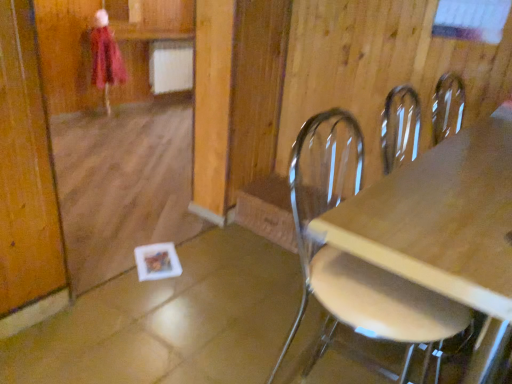
Locate an element on the screen. The image size is (512, 384). matte pink coat at upper left is located at coordinates (105, 57).

The height and width of the screenshot is (384, 512). What do you see at coordinates (105, 57) in the screenshot?
I see `matte pink coat at upper left` at bounding box center [105, 57].

What do you see at coordinates (355, 256) in the screenshot? The image size is (512, 384). I see `metallic silver chair at right` at bounding box center [355, 256].

You are a GUI agent. You are given a task and a screenshot of the screen. Output one action in this format:
    pyautogui.click(x=<x>, y=<y>)
    Task: Click on the metallic silver chair at right
    The height and width of the screenshot is (384, 512).
    Given the screenshot: What is the action you would take?
    pyautogui.click(x=355, y=256)

This screenshot has height=384, width=512. In order to click on matte pink coat at upper left in this screenshot , I will do `click(105, 57)`.

Can you confirm if metallic silver chair at right is positioned to the right of matte pink coat at upper left?

Indeed, metallic silver chair at right is positioned on the right side of matte pink coat at upper left.

Relative to matte pink coat at upper left, is metallic silver chair at right in front or behind?

metallic silver chair at right is in front of matte pink coat at upper left.

Considering the positions of point (302, 143) and point (117, 61), is point (302, 143) closer or farther from the camera than point (117, 61)?

Point (302, 143) appears to be closer to the viewer than point (117, 61).

From the image's perspective, is metallic silver chair at right under matte pink coat at upper left?

Correct, metallic silver chair at right appears lower than matte pink coat at upper left in the image.

From a real-world perspective, is metallic silver chair at right located higher than matte pink coat at upper left?

Yes, from a real-world perspective, metallic silver chair at right is above matte pink coat at upper left.

Considering the sizes of objects metallic silver chair at right and matte pink coat at upper left in the image provided, who is thinner, metallic silver chair at right or matte pink coat at upper left?

matte pink coat at upper left is thinner.

Does metallic silver chair at right have a greater height compared to matte pink coat at upper left?

Indeed, metallic silver chair at right has a greater height compared to matte pink coat at upper left.

Based on their sizes in the image, would you say metallic silver chair at right is bigger or smaller than matte pink coat at upper left?

Clearly, metallic silver chair at right is larger in size than matte pink coat at upper left.

Would you say matte pink coat at upper left is part of metallic silver chair at right's contents?

No, matte pink coat at upper left is not a part of metallic silver chair at right.

Is metallic silver chair at right next to matte pink coat at upper left?

They are not placed beside each other.

Is metallic silver chair at right facing towards matte pink coat at upper left?

No, metallic silver chair at right is not aimed at matte pink coat at upper left.

What's the angular difference between metallic silver chair at right and matte pink coat at upper left's facing directions?

The angle between the facing direction of metallic silver chair at right and the facing direction of matte pink coat at upper left is 90.2 degrees.

Image resolution: width=512 pixels, height=384 pixels. I want to click on person below the metallic silver chair at right (from a real-world perspective), so click(x=105, y=57).

Based on their positions, is matte pink coat at upper left located to the left or right of metallic silver chair at right?

Clearly, matte pink coat at upper left is on the left of metallic silver chair at right in the image.

Considering their positions, is matte pink coat at upper left located in front of or behind metallic silver chair at right?

Visually, matte pink coat at upper left is located behind metallic silver chair at right.

Which is more distant, [111,46] or [303,211]?

The point [111,46] is farther.

From the image's perspective, which one is positioned higher, matte pink coat at upper left or metallic silver chair at right?

matte pink coat at upper left is shown above in the image.

From a real-world perspective, is matte pink coat at upper left located higher than metallic silver chair at right?

Actually, matte pink coat at upper left is physically below metallic silver chair at right in the real world.

Does matte pink coat at upper left have a greater width compared to metallic silver chair at right?

No, matte pink coat at upper left is not wider than metallic silver chair at right.

From their relative heights in the image, would you say matte pink coat at upper left is taller or shorter than metallic silver chair at right?

matte pink coat at upper left is shorter than metallic silver chair at right.

Looking at the image, does matte pink coat at upper left seem bigger or smaller compared to metallic silver chair at right?

matte pink coat at upper left is smaller than metallic silver chair at right.

Consider the image. Is metallic silver chair at right a part of matte pink coat at upper left?

No, metallic silver chair at right is not surrounded by matte pink coat at upper left.

Is matte pink coat at upper left with metallic silver chair at right?

No, matte pink coat at upper left is not next to metallic silver chair at right.

Is matte pink coat at upper left oriented away from metallic silver chair at right?

No, matte pink coat at upper left is not facing the opposite direction of metallic silver chair at right.

How far apart are matte pink coat at upper left and metallic silver chair at right?

10.79 feet.

This screenshot has height=384, width=512. I want to click on person behind the metallic silver chair at right, so click(x=105, y=57).

Find the location of a particular element. This screenshot has width=512, height=384. person beneath the metallic silver chair at right (from a real-world perspective) is located at coordinates coord(105,57).

Identify the location of chair below the matte pink coat at upper left (from the image's perspective). The height and width of the screenshot is (384, 512). (355, 256).